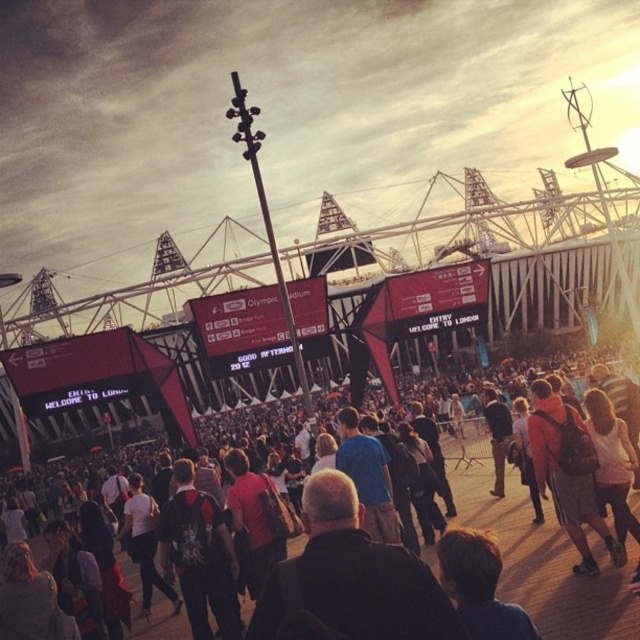
From the picture: You are a photographer trying to capture a clear shot of the matte black backpack at center. However, there is a matte black crowd at center in the way. Considering their sizes, which object is more likely to block your view of the backpack?

The matte black crowd at center has a larger size compared to the matte black backpack at center, so it is more likely to block the view of the matte black backpack at center.

You are a photographer standing at the edge of the scene. You want to take a photo of the dark gray backpack at center without the matte black crowd at center blocking it. Is the crowd currently in front of or behind the backpack?

The matte black crowd at center is positioned over dark gray backpack at center, meaning the crowd is in front of the backpack, blocking it from view.